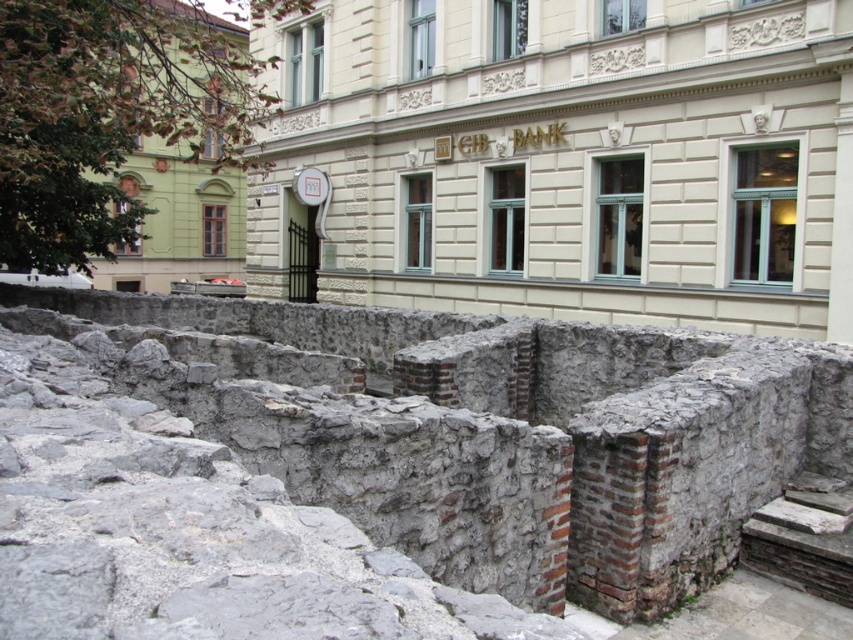
Question: Is stone wall ruins at center above gray stone wall at center?

Choices:
 (A) no
 (B) yes

Answer: (B)

Question: Which point appears closest to the camera in this image?

Choices:
 (A) (299, 154)
 (B) (367, 528)

Answer: (B)

Question: Is the position of stone wall ruins at center more distant than that of gray stone wall at center?

Choices:
 (A) yes
 (B) no

Answer: (A)

Question: Which object appears closest to the camera in this image?

Choices:
 (A) stone wall ruins at center
 (B) gray stone wall at center

Answer: (B)

Question: Is stone wall ruins at center closer to the viewer compared to gray stone wall at center?

Choices:
 (A) no
 (B) yes

Answer: (A)